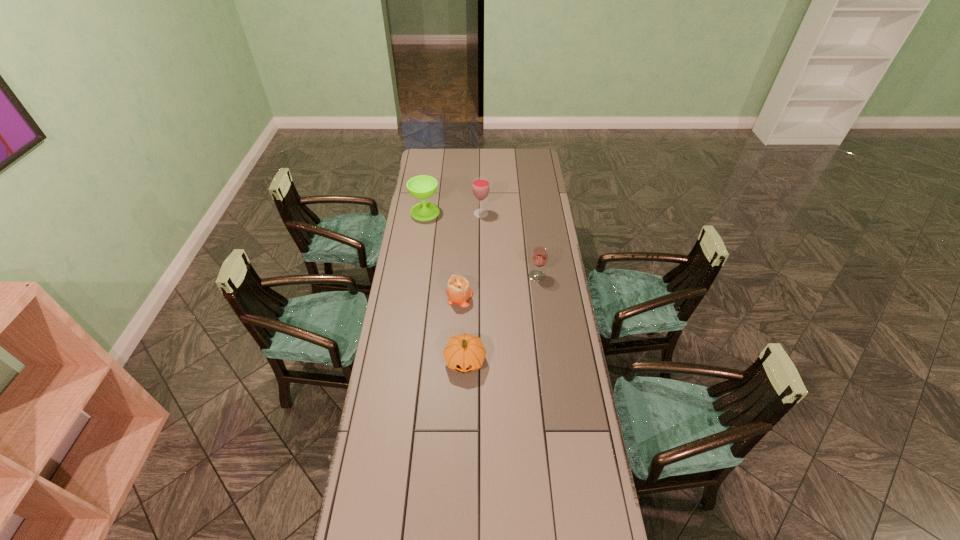
Where is `vacant area that lies between the candle and the second wineglass from right to left`? vacant area that lies between the candle and the second wineglass from right to left is located at coordinates (470, 255).

You are a GUI agent. You are given a task and a screenshot of the screen. Output one action in this format:
    pyautogui.click(x=<x>, y=<y>)
    Task: Click on the vacant area that lies between the gourd and the second wineglass from right to left
    Image resolution: width=960 pixels, height=540 pixels.
    Given the screenshot: What is the action you would take?
    pyautogui.click(x=473, y=287)

Where is `vacant point located between the gourd and the second nearest object`? The height and width of the screenshot is (540, 960). vacant point located between the gourd and the second nearest object is located at coordinates (462, 328).

Image resolution: width=960 pixels, height=540 pixels. Identify the location of vacant space that is in between the candle and the second wineglass from left to right. (470, 255).

Locate an element on the screen. Image resolution: width=960 pixels, height=540 pixels. vacant space in between the second wineglass from left to right and the fourth farthest object is located at coordinates coord(470,255).

Where is `the third closest object to the nearest object`? The width and height of the screenshot is (960, 540). the third closest object to the nearest object is located at coordinates (422, 187).

Select which object appears as the third closest to the leftmost object. Please provide its 2D coordinates. Your answer should be formatted as a tuple, i.e. [(x, y)], where the tuple contains the x and y coordinates of a point satisfying the conditions above.

[(539, 257)]

You are a GUI agent. You are given a task and a screenshot of the screen. Output one action in this format:
    pyautogui.click(x=<x>, y=<y>)
    Task: Click on the closest wineglass to the leftmost object
    
    Given the screenshot: What is the action you would take?
    pyautogui.click(x=480, y=186)

Choose which wineglass is the second nearest neighbor to the leftmost object. Please provide its 2D coordinates. Your answer should be formatted as a tuple, i.e. [(x, y)], where the tuple contains the x and y coordinates of a point satisfying the conditions above.

[(539, 257)]